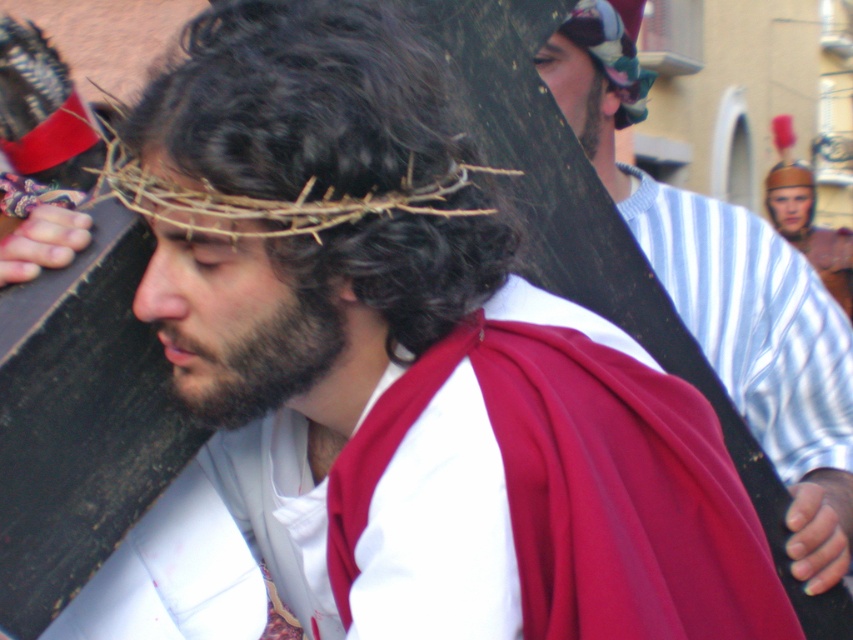
In the religious procession scene, there is a central figure wearing a brown woven crown at center and carrying a smooth brown wooden cross at center. From the observer standing in front of the figure, which object is positioned to the left?

The brown woven crown at center is to the left of the smooth brown wooden cross at center.

Based on the description, which object is larger in size between the brown woven crown at center and the multicolored fabric headband at upper center?

The brown woven crown at center is bigger than the multicolored fabric headband at upper center according to the description.